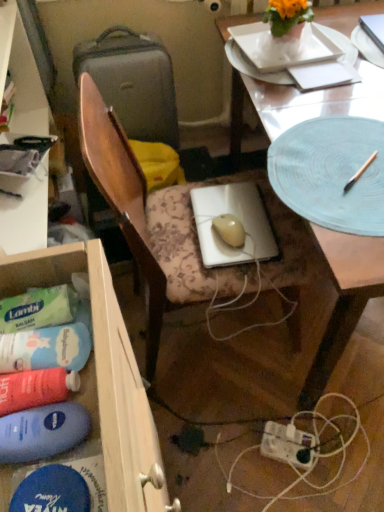
The height and width of the screenshot is (512, 384). What are the coordinates of `vacant position to the left of white paper at upper right` in the screenshot? It's located at (269, 85).